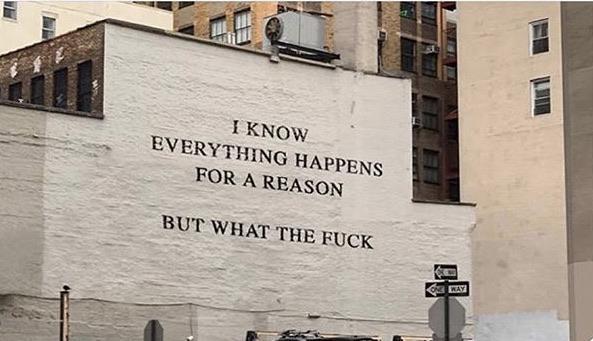
Find the location of a particular element. air conditioner is located at coordinates (277, 28).